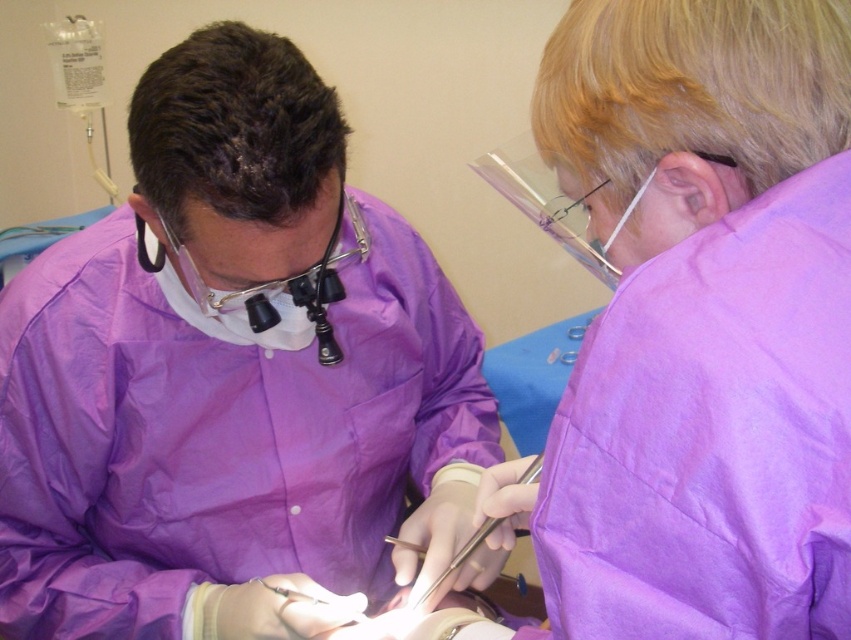
Question: Is the position of purple matte surgical gown at center less distant than that of metallic silver scalpel at center?

Choices:
 (A) yes
 (B) no

Answer: (A)

Question: Which point is closer to the camera?

Choices:
 (A) purple matte surgical gown at center
 (B) metallic silver scalpel at center

Answer: (A)

Question: Which of the following is the farthest from the observer?

Choices:
 (A) (446, 576)
 (B) (294, 406)

Answer: (B)

Question: Where is purple matte surgical gown at center located in relation to metallic silver scalpel at center in the image?

Choices:
 (A) below
 (B) above

Answer: (B)

Question: Which of the following is the closest to the observer?

Choices:
 (A) metallic silver scalpel at center
 (B) purple matte surgical gown at center

Answer: (B)

Question: Is purple matte surgical gown at center to the right of metallic silver scalpel at center from the viewer's perspective?

Choices:
 (A) yes
 (B) no

Answer: (B)